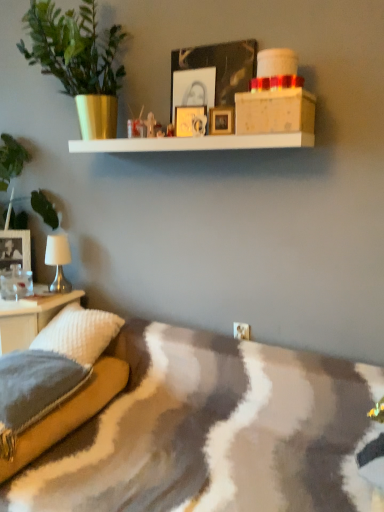
The height and width of the screenshot is (512, 384). Describe the element at coordinates (275, 112) in the screenshot. I see `white textured box at upper center` at that location.

I want to click on green matte plant at left, so click(x=78, y=61).

Image resolution: width=384 pixels, height=512 pixels. What do you see at coordinates (79, 333) in the screenshot? I see `white textured pillow at lower left, the 1th pillow viewed from the back` at bounding box center [79, 333].

What do you see at coordinates (33, 390) in the screenshot? I see `textured gray pillow at lower left, the 1th pillow positioned from the front` at bounding box center [33, 390].

The width and height of the screenshot is (384, 512). Find the location of `green leafy plant at left`. green leafy plant at left is located at coordinates (11, 160).

You are a GUI agent. You are given a task and a screenshot of the screen. Output one action in this format:
    pyautogui.click(x=<x>, y=<y>)
    Task: Click on the white textured box at upper center
    This screenshot has width=384, height=512.
    Given the screenshot: What is the action you would take?
    pyautogui.click(x=275, y=112)

Is black matte picture frame at left, placed as the fourth picture frame when sorted from top to bottom, in front of or behind green matte plant at left in the image?

Clearly, black matte picture frame at left, placed as the fourth picture frame when sorted from top to bottom, is behind green matte plant at left.

Based on their sizes in the image, would you say black matte picture frame at left, the 4th picture frame positioned from the front, is bigger or smaller than green matte plant at left?

Considering their sizes, black matte picture frame at left, the 4th picture frame positioned from the front, takes up less space than green matte plant at left.

Considering the sizes of black matte picture frame at left, the 1th picture frame from the back, and green matte plant at left in the image, is black matte picture frame at left, the 1th picture frame from the back, wider or thinner than green matte plant at left?

black matte picture frame at left, the 1th picture frame from the back, is thinner than green matte plant at left.

Is black matte picture frame at left, arranged as the 1th picture frame when ordered from the bottom, with green matte plant at left?

No, black matte picture frame at left, arranged as the 1th picture frame when ordered from the bottom, is not in contact with green matte plant at left.

From their relative heights in the image, would you say white textured box at upper center is taller or shorter than green matte plant at left?

Considering their sizes, white textured box at upper center has less height than green matte plant at left.

From the image's perspective, which one is positioned higher, white textured box at upper center or green matte plant at left?

green matte plant at left appears higher in the image.

Is white textured box at upper center positioned with its back to green matte plant at left?

white textured box at upper center is not turned away from green matte plant at left.

Considering their positions, is white matte table lamp at left located in front of or behind white glossy table at lower left?

In the image, white matte table lamp at left appears behind white glossy table at lower left.

The image size is (384, 512). Identify the location of table below the white matte table lamp at left (from the image's perspective). coord(29,318).

Which is in front, point (57, 244) or point (2, 311)?

The point (2, 311) is more forward.

From the image's perspective, would you say white matte table lamp at left is positioned over white glossy table at lower left?

Yes.

Is white glossy table at lower left positioned with its back to white matte table lamp at left?

No, white glossy table at lower left's orientation is not away from white matte table lamp at left.

Based on the photo, what's the angular difference between white glossy table at lower left and white matte table lamp at left's facing directions?

The facing directions of white glossy table at lower left and white matte table lamp at left are 0.00319 degrees apart.

Is white glossy table at lower left next to white matte table lamp at left?

No, white glossy table at lower left is not making contact with white matte table lamp at left.

From a real-world perspective, is white glossy table at lower left positioned under white matte table lamp at left based on gravity?

Yes, from a real-world perspective, white glossy table at lower left is below white matte table lamp at left.

From a real-world perspective, relative to white matte table lamp at left, is white textured box at upper center vertically above or below?

white textured box at upper center is above white matte table lamp at left.

Is white textured box at upper center located outside white matte table lamp at left?

That's correct, white textured box at upper center is outside of white matte table lamp at left.

Does point (301, 103) appear closer or farther from the camera than point (60, 280)?

Point (301, 103) appears to be closer to the viewer than point (60, 280).

From the image's perspective, is white matte table lamp at left located beneath gold metallic picture frame at upper center, arranged as the first picture frame when viewed from the right?

Yes, from the image's perspective, white matte table lamp at left is beneath gold metallic picture frame at upper center, arranged as the first picture frame when viewed from the right.

Is point (53, 259) closer to camera compared to point (222, 116)?

No, it is behind (222, 116).

Is white matte table lamp at left with gold metallic picture frame at upper center, arranged as the first picture frame when viewed from the right?

No, white matte table lamp at left is not in contact with gold metallic picture frame at upper center, arranged as the first picture frame when viewed from the right.

Would you say white matte table lamp at left is to the left or to the right of gold metallic picture frame at upper center, the 4th picture frame when ordered from left to right, in the picture?

From the image, it's evident that white matte table lamp at left is to the left of gold metallic picture frame at upper center, the 4th picture frame when ordered from left to right.

Is white textured box at upper center taller than black matte picture frame at left, placed as the fourth picture frame when sorted from top to bottom?

No, white textured box at upper center is not taller than black matte picture frame at left, placed as the fourth picture frame when sorted from top to bottom.

At what (x,y) coordinates should I click in order to perform the action: click on picture frame below the white textured box at upper center (from the image's perspective). Please return your answer as a coordinate pair (x, y). Looking at the image, I should click on (15, 249).

Can you see white textured box at upper center touching black matte picture frame at left, the 1th picture frame from the back?

white textured box at upper center and black matte picture frame at left, the 1th picture frame from the back, are not in contact.

Is white textured box at upper center inside the boundaries of black matte picture frame at left, arranged as the 1th picture frame when ordered from the bottom, or outside?

white textured box at upper center is spatially situated outside black matte picture frame at left, arranged as the 1th picture frame when ordered from the bottom.

From the image's perspective, which picture frame is the 4th one below the green matte plant at left? Please provide its 2D coordinates.

[(15, 249)]

Locate an element on the screen. houseplant on the left of white textured box at upper center is located at coordinates (78, 61).

Based on their spatial positions, is white matte table lamp at left or black matte picture frame at left, arranged as the 1th picture frame when ordered from the bottom, further from wooden picture frame at upper center, which ranks as the 2th picture frame in top-to-bottom order?

Among the two, black matte picture frame at left, arranged as the 1th picture frame when ordered from the bottom, is located further to wooden picture frame at upper center, which ranks as the 2th picture frame in top-to-bottom order.

Looking at the image, which one is located closer to white textured box at upper center, green matte plant at left or black matte picture frame at left, arranged as the 1th picture frame when ordered from the bottom?

The object closer to white textured box at upper center is green matte plant at left.

When comparing their distances from gold metallic picture frame at upper center, which ranks as the first picture frame in front-to-back order, does black matte picture frame at left, which appears as the fourth picture frame when viewed from the right, or white glossy table at lower left seem further?

Among the two, black matte picture frame at left, which appears as the fourth picture frame when viewed from the right, is located further to gold metallic picture frame at upper center, which ranks as the first picture frame in front-to-back order.

In the scene shown: Considering their positions, is wooden picture frame at upper center, arranged as the 3th picture frame when viewed from the back, positioned further to white matte table lamp at left than white textured box at upper center?

white textured box at upper center is further to white matte table lamp at left.

Considering their positions, is gold metallic picture frame at upper center, the 3th picture frame in the front-to-back sequence, positioned further to white textured box at upper center than white textured pillow at lower left, which ranks as the 2th pillow in front-to-back order?

Based on the image, white textured pillow at lower left, which ranks as the 2th pillow in front-to-back order, appears to be further to white textured box at upper center.

Looking at the image, which one is located closer to textured gray pillow at lower left, the second pillow when ordered from back to front, white glossy table at lower left or white matte table lamp at left?

white glossy table at lower left is positioned closer to the anchor textured gray pillow at lower left, the second pillow when ordered from back to front.

When comparing their distances from white textured pillow at lower left, which ranks as the 2th pillow in front-to-back order, does green matte plant at left or green leafy plant at left seem closer?

green leafy plant at left lies closer to white textured pillow at lower left, which ranks as the 2th pillow in front-to-back order, than the other object.

Which object lies further to the anchor point white textured box at upper center, green leafy plant at left or gold metallic picture frame at upper center, arranged as the first picture frame when viewed from the right?

Based on the image, green leafy plant at left appears to be further to white textured box at upper center.

Find the location of a particular element. plant between green matte plant at left and white glossy table at lower left in the vertical direction is located at coordinates (11, 160).

At what (x,y) coordinates should I click in order to perform the action: click on houseplant located between green leafy plant at left and wooden picture frame at upper center, arranged as the 2th picture frame when viewed from the left, in the left-right direction. Please return your answer as a coordinate pair (x, y). The image size is (384, 512). Looking at the image, I should click on (78, 61).

In order to click on table between green leafy plant at left and gold metallic picture frame at upper center, acting as the 4th picture frame starting from the bottom, in the horizontal direction in this screenshot , I will do `click(29, 318)`.

At what (x,y) coordinates should I click in order to perform the action: click on table lamp between white textured pillow at lower left, which ranks as the 2th pillow in front-to-back order, and black matte picture frame at left, which is the first picture frame from left to right, in the front-back direction. Please return your answer as a coordinate pair (x, y). Looking at the image, I should click on [x=58, y=261].